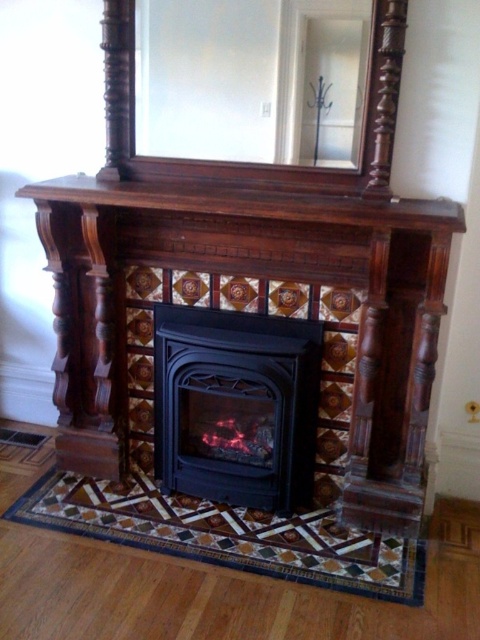
You are decorating a living room and want to hang a new picture above the black matte fireplace at center. The picture is 1 meter tall. Can the clear glass mirror at upper center stay in its current position without needing to be moved?

The clear glass mirror at upper center is above the black matte fireplace at center, so it would need to be moved to accommodate the new picture unless there is space between them. However, since the mirror is already positioned above the fireplace, hanging a 1 meter tall picture might require adjusting the mirror or ensuring there is enough vertical space between the mirror and the fireplace to fit the picture without overlapping.

Consider the image. You are standing in a living room and want to take a photo of the black matte fireplace at center. If your camera can focus on objects up to 2 meters away, will it be able to capture the fireplace clearly?

The black matte fireplace at center is 2.28 meters from the camera, which is beyond the camera focus range of 2 meters. Therefore, the camera cannot capture the fireplace clearly.